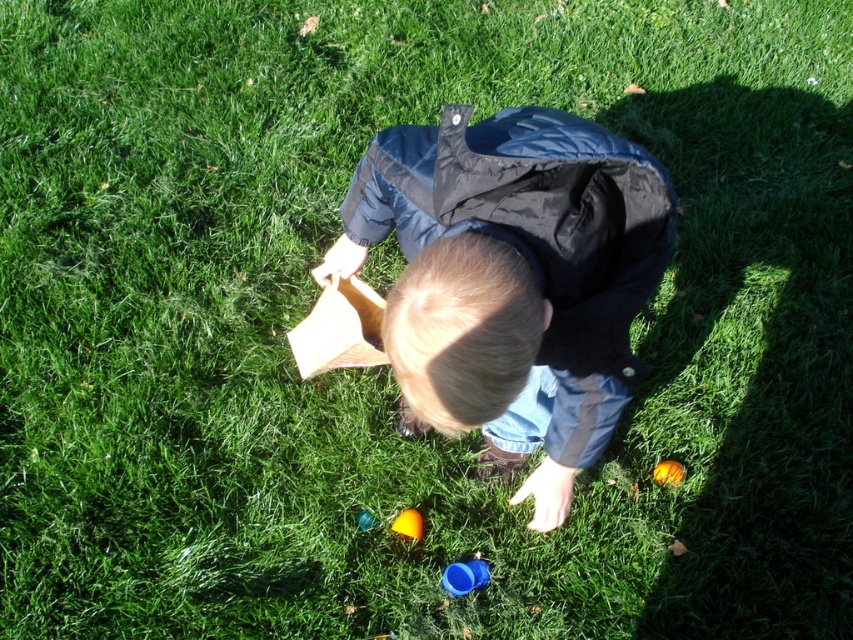
You are a photographer trying to capture the blue plastic cup at lower center and the shiny blue plastic cup at center in a single shot. Which cup should you focus on first to ensure both are in frame?

The blue plastic cup at lower center is in front of the shiny blue plastic cup at center, so you should focus on the shiny blue plastic cup at center first to ensure both are in frame.

You are a drone operator trying to capture a photo of the child holding the small wooden object and reaching towards the cups. The camera is positioned at point A, which is at coordinates point [676,468]. You need to adjust the camera to point B at coordinates point [357,515] to get a better angle. From the child perspective, which direction should you move the camera to reach point B from point A?

From the child perspective, you should move the camera forward because point [676,468] is behind point [357,515].